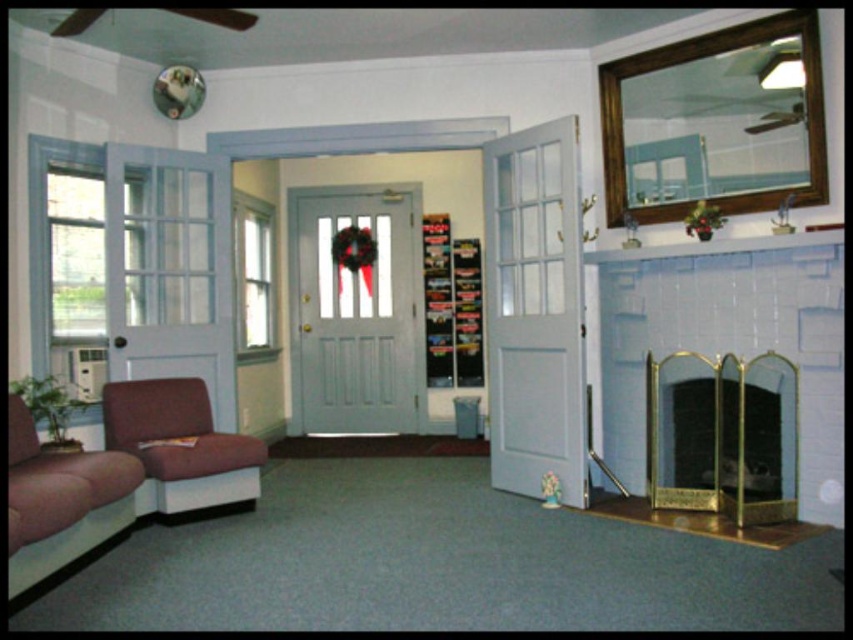
The width and height of the screenshot is (853, 640). In order to click on velvet maroon armchair at lower left in this screenshot , I will do `click(178, 445)`.

Is point (198, 417) positioned behind point (552, 506)?

Yes, it is behind point (552, 506).

Is point (148, 419) positioned in front of point (556, 484)?

That is True.

Find the location of a particular element. The height and width of the screenshot is (640, 853). velvet maroon armchair at lower left is located at coordinates (178, 445).

Which is above, white painted wood door at right or gold metallic fireplace screen at right?

Positioned higher is white painted wood door at right.

Is point (540, 417) positioned in front of point (757, 458)?

No, it is not.

At what (x,y) coordinates should I click in order to perform the action: click on white painted wood door at right. Please return your answer as a coordinate pair (x, y). Looking at the image, I should click on (534, 310).

Who is more distant from viewer, (360, 426) or (25, 406)?

Positioned behind is point (360, 426).

Is matte gray door at center wider than velvet maroon couch at lower left?

Yes, matte gray door at center is wider than velvet maroon couch at lower left.

What are the coordinates of `matte gray door at center` in the screenshot? It's located at coord(355,312).